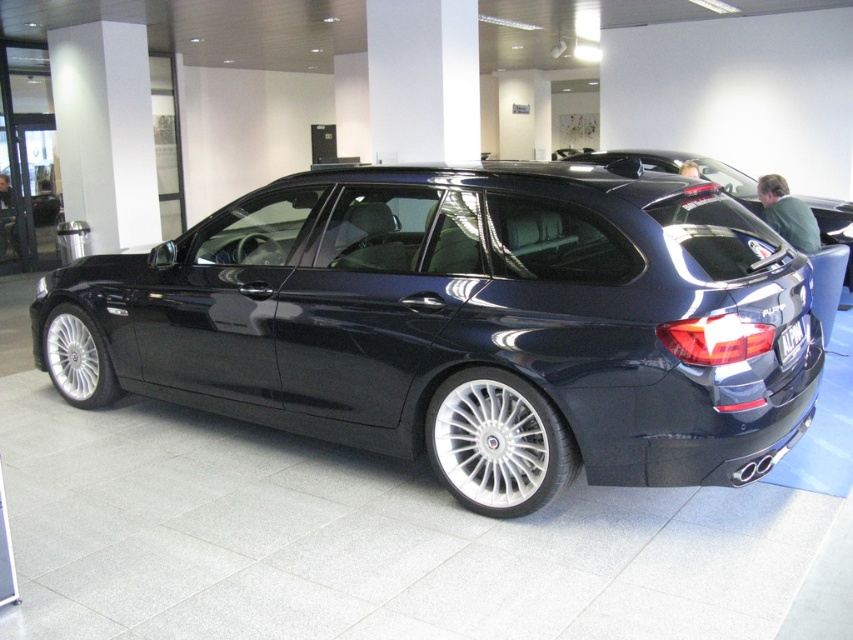
You are a photographer setting up a shoot for the glossy black car at center and the black plastic license plate at rear. You want to position your camera so that both objects are visible in the frame. Based on their positions, which object should be placed closer to the left edge of the frame?

The black plastic license plate at rear should be placed closer to the left edge of the frame because the glossy black car at center is positioned to the right of it.

You are standing in the showroom and want to take a photo of the glossy black car at center from the point at point (677, 170). Is this the best spot to capture the car from the front?

The glossy black car at center is located at point (677, 170), so yes, standing at that point would be the best spot to capture the car from the front.

From the picture: You are a delivery person who needs to park the glossy dark blue wagon at center in a parking spot that has a height restriction of 1.8 meters. Given that the black plastic license plate at rear is positioned at the bottom of the vehicle, can you determine if the wagon will exceed the height limit?

The glossy dark blue wagon at center is much taller than the black plastic license plate at rear, which is at the bottom of the vehicle. Since the license plate is at the lowest point, the wagon likely exceeds the 1.8 meter height restriction.